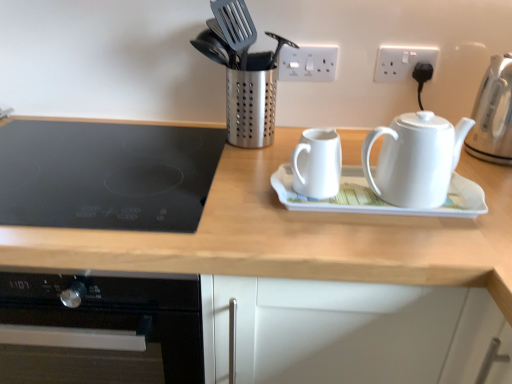
Where is `free space to the left of white glossy teapot at center, placed as the 3th kettle when sorted from right to left`? free space to the left of white glossy teapot at center, placed as the 3th kettle when sorted from right to left is located at coordinates (226, 189).